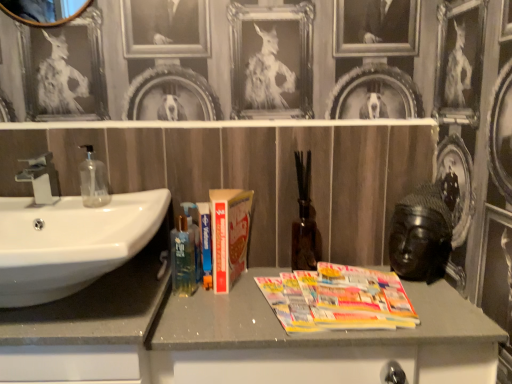
The image size is (512, 384). I want to click on free space to the left of transparent glass soap dispenser at left, so click(54, 203).